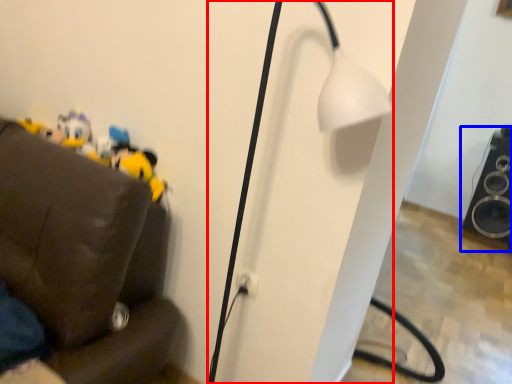
Question: Which object is closer to the camera taking this photo, lamp (highlighted by a red box) or speaker (highlighted by a blue box)?

Choices:
 (A) lamp
 (B) speaker

Answer: (A)